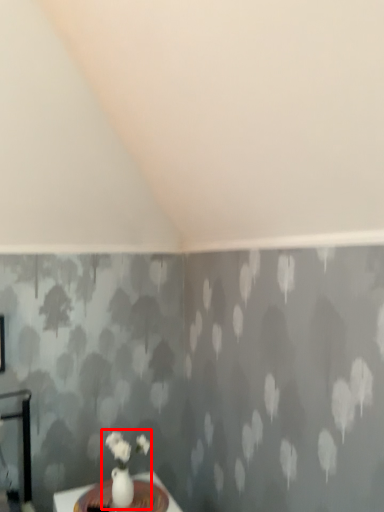
Question: Considering the relative positions of floral arrangement (annotated by the red box) and table in the image provided, where is floral arrangement (annotated by the red box) located with respect to the staircase?

Choices:
 (A) right
 (B) left

Answer: (A)